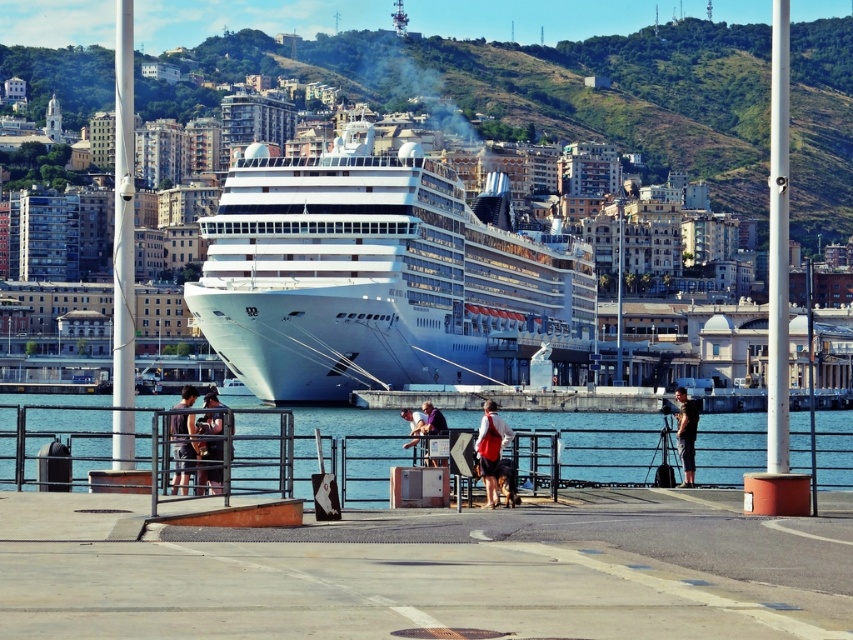
From the picture: You are standing at the waterfront and see the clear blue water at lower center and the dark gray fabric shirt at center. Which object is positioned to the right of the other?

The clear blue water at lower center is positioned to the right of the dark gray fabric shirt at center.

You are a photographer standing at the waterfront. You want to take a photo that includes both the white glossy cruise ship at center and the purple fabric jacket at center. Which object should you focus on first if you want to ensure both are in the frame?

The white glossy cruise ship at center is larger in size than the purple fabric jacket at center, so you should focus on the white glossy cruise ship at center first to ensure both are in the frame.

You are standing at the waterfront and want to take a photo of the white glossy cruise ship at center. If your camera has a maximum zoom range of 1000 feet, can you capture the ship clearly without moving closer?

The white glossy cruise ship at center is 471.16 feet away from the camera, which is within the maximum zoom range of 1000 feet. Therefore, you can capture the ship clearly without moving closer.